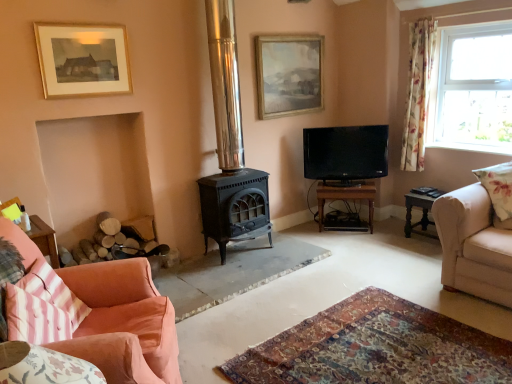
Question: Would you say brown wooden table at center, the second table when ordered from right to left, is part of pink striped cushion at lower left, the 2th pillow when ordered from back to front,'s contents?

Choices:
 (A) no
 (B) yes

Answer: (A)

Question: From the image's perspective, is pink striped cushion at lower left, the 2th pillow when ordered from back to front, beneath brown wooden table at center, the second table when ordered from right to left?

Choices:
 (A) yes
 (B) no

Answer: (A)

Question: Can you confirm if pink striped cushion at lower left, acting as the first pillow starting from the bottom, is thinner than brown wooden table at center, the first table viewed from the left?

Choices:
 (A) yes
 (B) no

Answer: (A)

Question: Are pink striped cushion at lower left, which appears as the first pillow when viewed from the left, and brown wooden table at center, the second table when ordered from right to left, beside each other?

Choices:
 (A) no
 (B) yes

Answer: (A)

Question: From a real-world perspective, is pink striped cushion at lower left, which appears as the first pillow when viewed from the left, located higher than brown wooden table at center, the first table viewed from the left?

Choices:
 (A) no
 (B) yes

Answer: (B)

Question: Does pink striped cushion at lower left, which appears as the 2th pillow when viewed from the right, have a lesser height compared to brown wooden table at center, the second table when ordered from right to left?

Choices:
 (A) yes
 (B) no

Answer: (A)

Question: Does pink striped cushion at lower left, the second pillow in the top-to-bottom sequence, have a greater height compared to clear glass window at upper right?

Choices:
 (A) no
 (B) yes

Answer: (A)

Question: Could clear glass window at upper right be considered to be inside pink striped cushion at lower left, the second pillow in the top-to-bottom sequence?

Choices:
 (A) no
 (B) yes

Answer: (A)

Question: From the image's perspective, would you say pink striped cushion at lower left, which appears as the first pillow when viewed from the left, is shown under clear glass window at upper right?

Choices:
 (A) no
 (B) yes

Answer: (B)

Question: Can you confirm if pink striped cushion at lower left, which is the 1th pillow from front to back, is bigger than clear glass window at upper right?

Choices:
 (A) no
 (B) yes

Answer: (A)

Question: Would you say pink striped cushion at lower left, the 2th pillow when ordered from back to front, is outside clear glass window at upper right?

Choices:
 (A) yes
 (B) no

Answer: (A)

Question: Is pink striped cushion at lower left, which is the 1th pillow from front to back, at the left side of clear glass window at upper right?

Choices:
 (A) yes
 (B) no

Answer: (A)

Question: From a real-world perspective, is pink striped cushion at lower left, which is the 1th pillow from front to back, under black glossy tv at center?

Choices:
 (A) yes
 (B) no

Answer: (A)